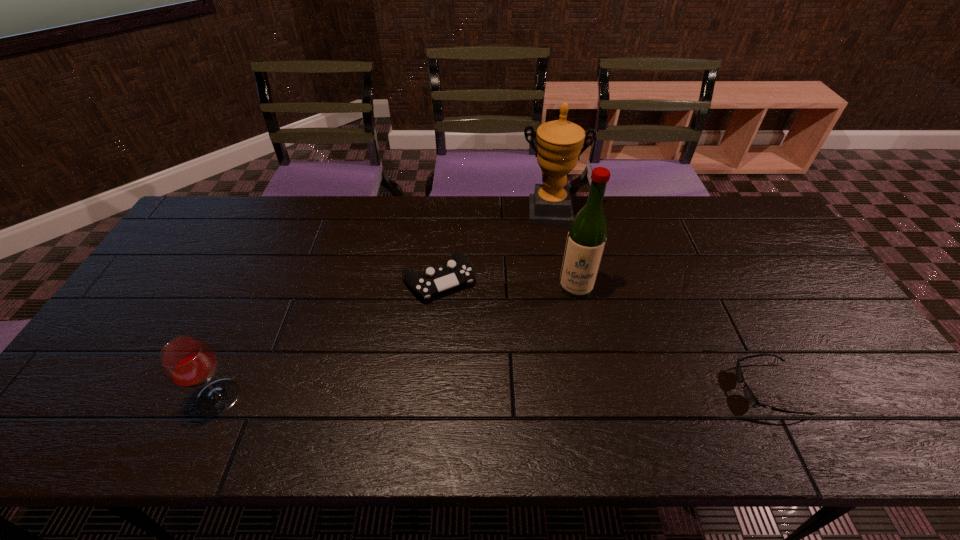
Choose which object is the nearest neighbor to the wineglass. Please provide its 2D coordinates. Your answer should be formatted as a tuple, i.e. [(x, y)], where the tuple contains the x and y coordinates of a point satisfying the conditions above.

[(458, 271)]

What are the coordinates of `free space that satisfies the following two spatial constraints: 1. on the back side of the wineglass; 2. on the right side of the liquor` in the screenshot? It's located at (269, 287).

Locate an element on the screen. This screenshot has height=540, width=960. vacant space that satisfies the following two spatial constraints: 1. on the front side of the farthest object; 2. on the front-facing side of the rightmost object is located at coordinates (580, 389).